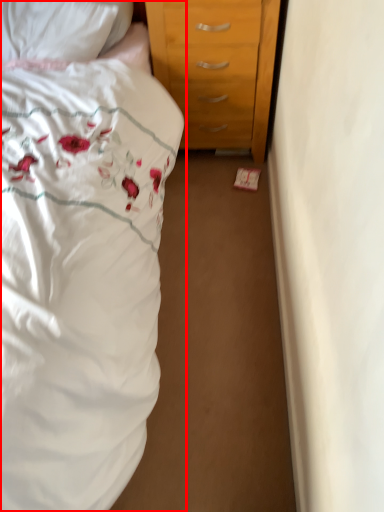
Question: In this image, where is bed (annotated by the red box) located relative to pillow?

Choices:
 (A) left
 (B) right

Answer: (A)